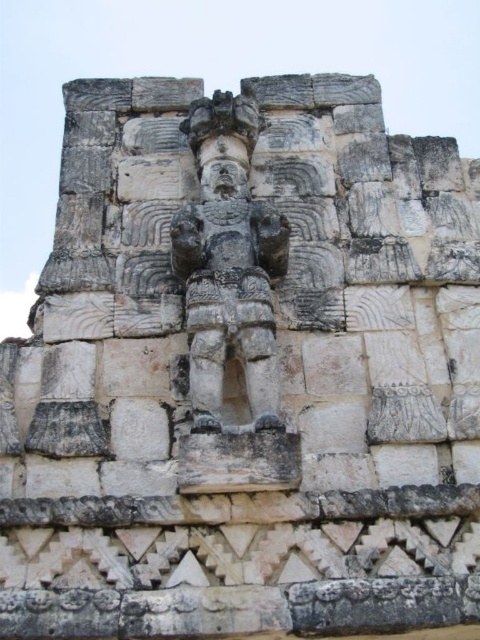
Question: Can you confirm if gray stone figure at center is positioned to the left of matte stone face at center?

Choices:
 (A) yes
 (B) no

Answer: (B)

Question: Which of the following is the farthest from the observer?

Choices:
 (A) gray stone figure at center
 (B) matte stone face at center

Answer: (B)

Question: Considering the relative positions of gray stone figure at center and matte stone face at center in the image provided, where is gray stone figure at center located with respect to matte stone face at center?

Choices:
 (A) above
 (B) below

Answer: (B)

Question: Which of the following is the closest to the observer?

Choices:
 (A) (245, 198)
 (B) (276, 227)

Answer: (B)

Question: From the image, what is the correct spatial relationship of gray stone figure at center in relation to matte stone face at center?

Choices:
 (A) below
 (B) above

Answer: (A)